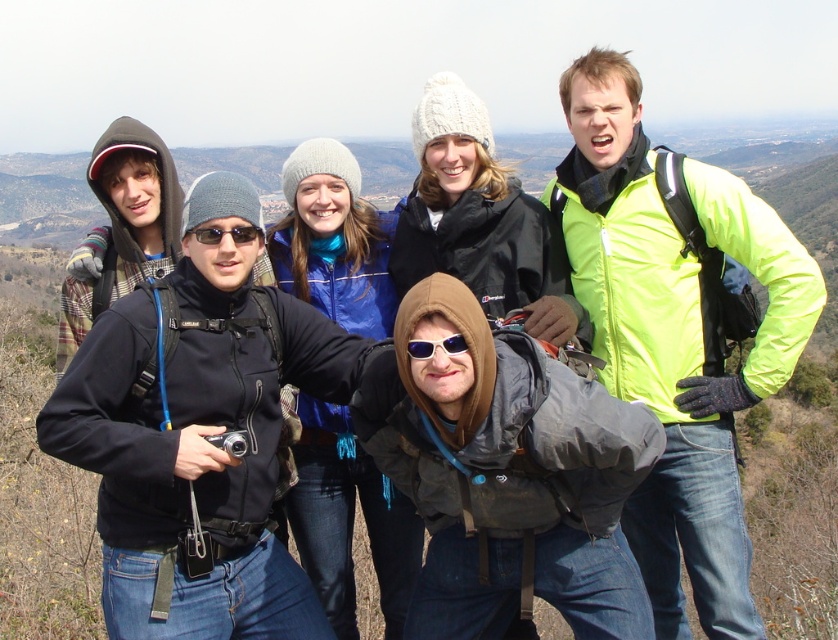
Question: Is sunglasses at center positioned behind black plastic sunglasses at center?

Choices:
 (A) no
 (B) yes

Answer: (A)

Question: Which of the following is the farthest from the observer?

Choices:
 (A) (585, 198)
 (B) (213, 236)
 (C) (463, 348)

Answer: (A)

Question: Does sunglasses at center have a greater width compared to black plastic sunglasses at center?

Choices:
 (A) no
 (B) yes

Answer: (A)

Question: Does neon yellow jacket at upper right have a greater width compared to sunglasses at center?

Choices:
 (A) yes
 (B) no

Answer: (A)

Question: Which point appears closest to the camera in this image?

Choices:
 (A) (430, 355)
 (B) (748, 252)

Answer: (A)

Question: Which of these objects is positioned closest to the sunglasses at center?

Choices:
 (A) neon yellow jacket at upper right
 (B) black plastic sunglasses at center

Answer: (B)